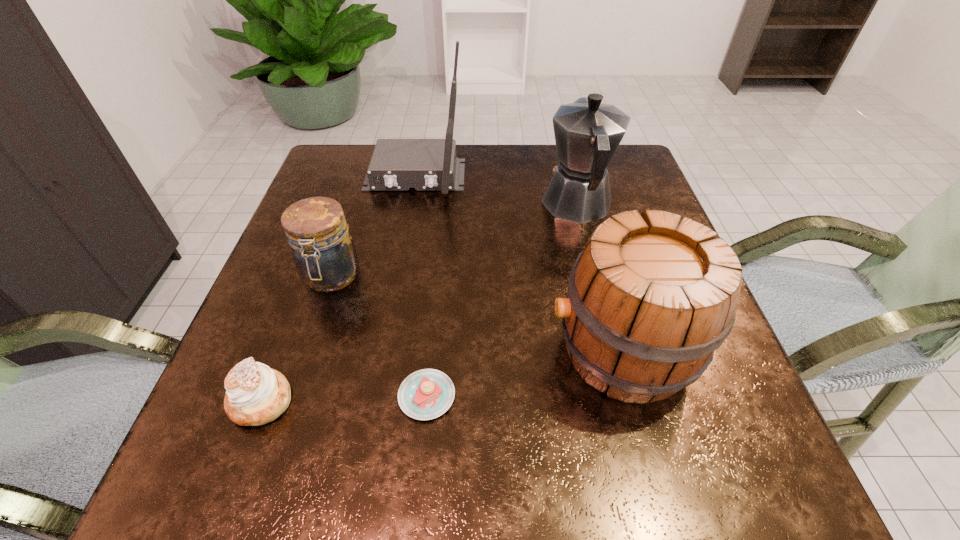
What are the coordinates of `free point that satisfies the following two spatial constraints: 1. on the back side of the shorter pastry; 2. on the left side of the fifth tallest object` in the screenshot? It's located at (263, 396).